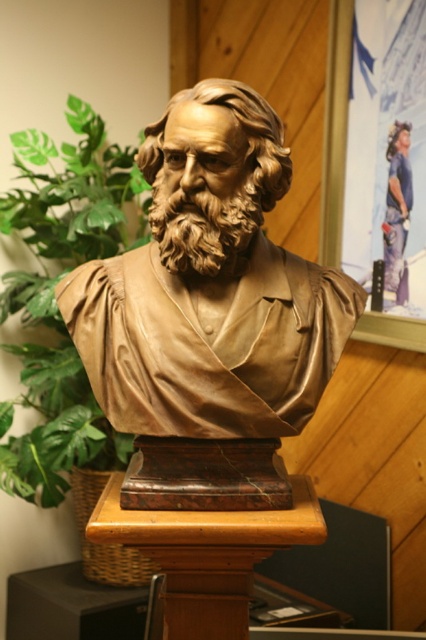
Does bronze statue at center have a greater height compared to green leafy plant at center?

No, bronze statue at center is not taller than green leafy plant at center.

Image resolution: width=426 pixels, height=640 pixels. What do you see at coordinates (210, 285) in the screenshot?
I see `bronze statue at center` at bounding box center [210, 285].

Where is `bronze statue at center`? bronze statue at center is located at coordinates (210, 285).